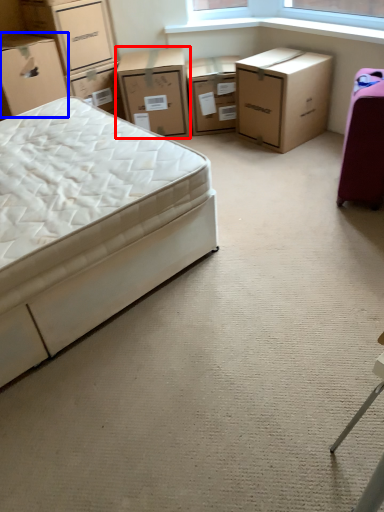
Question: Which point is closer to the camera, chest of drawers (highlighted by a red box) or box (highlighted by a blue box)?

Choices:
 (A) chest of drawers
 (B) box

Answer: (B)